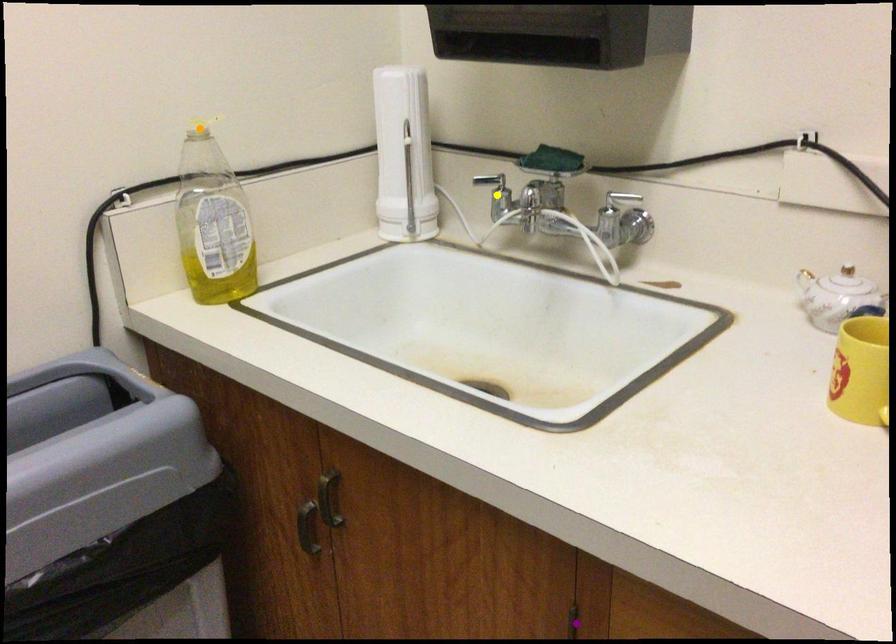
Order these from nearest to farthest:
A) yellow point
B) purple point
C) orange point

1. purple point
2. orange point
3. yellow point